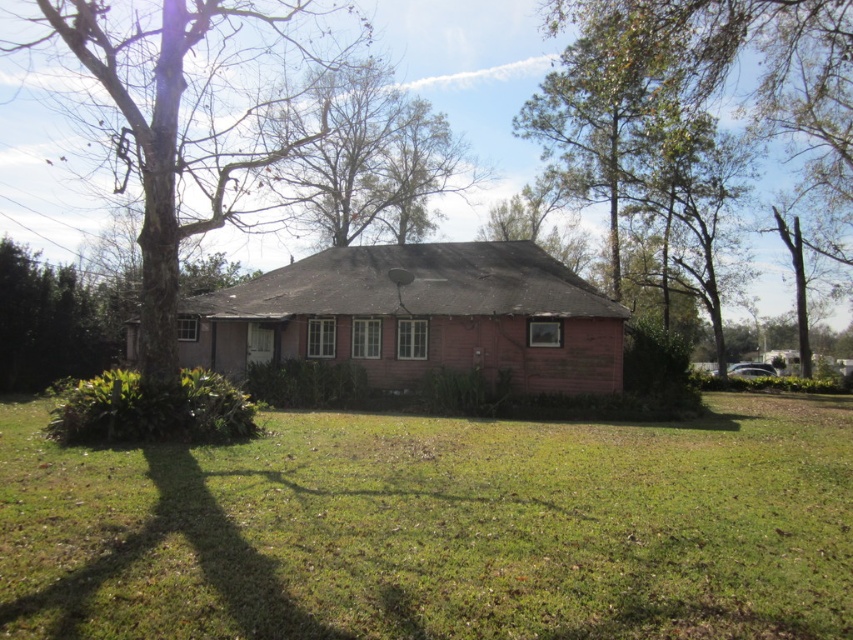
You are standing in front of the house and notice a point marked at coordinates [184,122]. What object does this point correspond to?

The point at coordinates [184,122] corresponds to the brown rough bark tree at left.

You are a gardener planning to trim the brown wood tree at center and the bare branches at upper center. Which object is located to the left of the other?

The brown wood tree at center is to the left of the bare branches at upper center.

You are standing in front of the house and looking towards the tree. Which object is closer to you, the brown rough bark tree at left or the bare branches at upper center?

The brown rough bark tree at left is closer to you because it is in front of the bare branches at upper center.